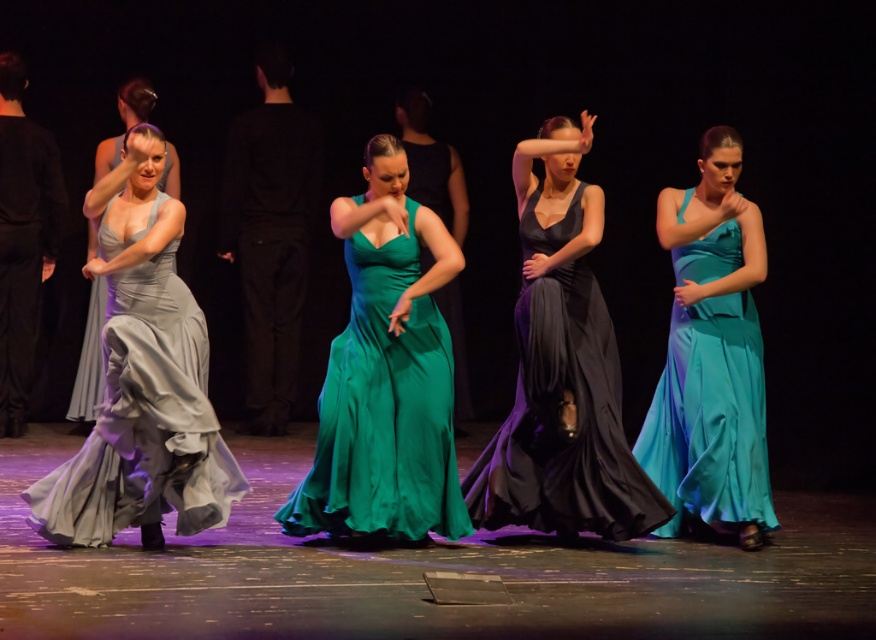
Is satin gray dress at left bigger than teal satin dress at center?

Indeed, satin gray dress at left has a larger size compared to teal satin dress at center.

Image resolution: width=876 pixels, height=640 pixels. Describe the element at coordinates (142, 378) in the screenshot. I see `satin gray dress at left` at that location.

Identify the location of satin gray dress at left. The image size is (876, 640). (142, 378).

How distant is teal satin dress at center from satin silver dress at left?

4.62 meters

Which is in front, point (726, 243) or point (177, 193)?

Positioned in front is point (726, 243).

Where is `teal satin dress at center`? teal satin dress at center is located at coordinates (711, 355).

The height and width of the screenshot is (640, 876). Describe the element at coordinates (562, 369) in the screenshot. I see `matte black dress at center` at that location.

In the scene shown: Who is more distant from viewer, (530, 412) or (715, 269)?

The point (715, 269) is more distant.

Locate an element on the screen. The width and height of the screenshot is (876, 640). matte black dress at center is located at coordinates (562, 369).